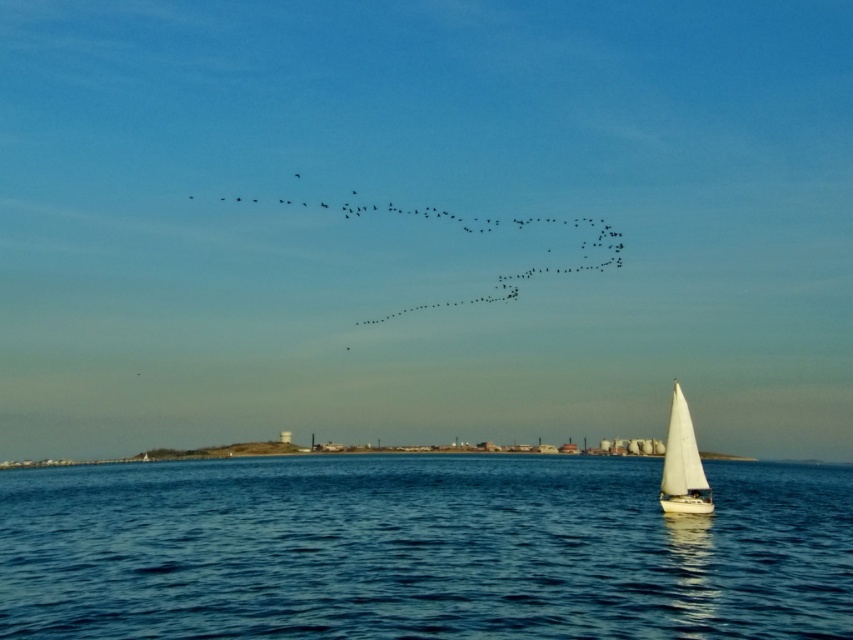
Question: Which of the following is the closest to the observer?

Choices:
 (A) (700, 474)
 (B) (471, 300)

Answer: (A)

Question: Does blue water at center have a larger size compared to black matte birds at upper center?

Choices:
 (A) no
 (B) yes

Answer: (B)

Question: Which of the following is the closest to the observer?

Choices:
 (A) white sailboat at lower right
 (B) black matte birds at upper center
 (C) blue water at center

Answer: (C)

Question: Which point appears closest to the camera in this image?

Choices:
 (A) (614, 250)
 (B) (669, 433)

Answer: (B)

Question: Can you confirm if black matte birds at upper center is bigger than white sailboat at lower right?

Choices:
 (A) yes
 (B) no

Answer: (A)

Question: Does black matte birds at upper center come in front of white sailboat at lower right?

Choices:
 (A) yes
 (B) no

Answer: (B)